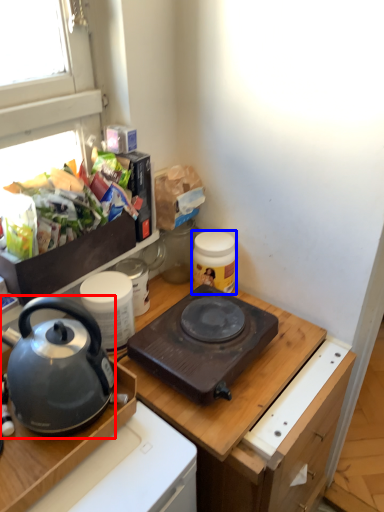
Question: Which object is closer to the camera taking this photo, kettle (highlighted by a red box) or kitchen appliance (highlighted by a blue box)?

Choices:
 (A) kettle
 (B) kitchen appliance

Answer: (A)